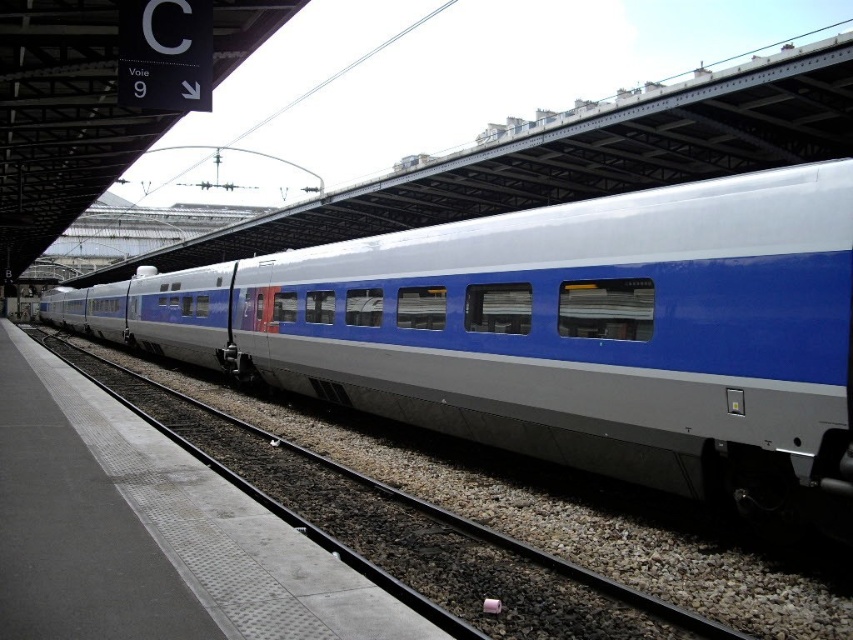
Question: Does metallic blue train at center appear over metallic gray track at center?

Choices:
 (A) no
 (B) yes

Answer: (B)

Question: Among these points, which one is farthest from the camera?

Choices:
 (A) (602, 296)
 (B) (281, 465)

Answer: (B)

Question: Can you confirm if metallic blue train at center is positioned to the right of metallic gray track at center?

Choices:
 (A) yes
 (B) no

Answer: (B)

Question: Which of the following is the closest to the observer?

Choices:
 (A) metallic gray track at center
 (B) metallic blue train at center

Answer: (A)

Question: Is metallic blue train at center bigger than metallic gray track at center?

Choices:
 (A) no
 (B) yes

Answer: (B)